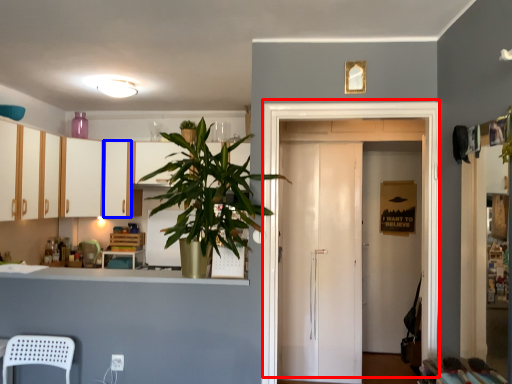
Question: Among these objects, which one is nearest to the camera, door (highlighted by a red box) or cabinetry (highlighted by a blue box)?

Choices:
 (A) door
 (B) cabinetry

Answer: (A)